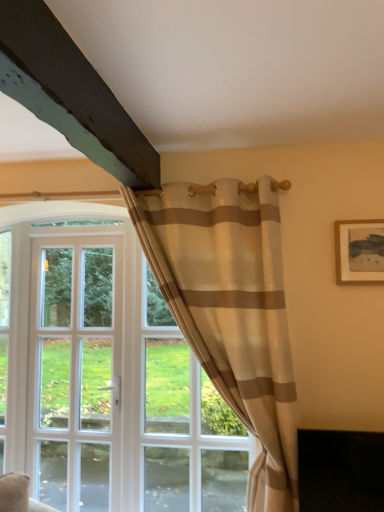
Question: Is wooden framed artwork at upper right outside white glass door at left?

Choices:
 (A) yes
 (B) no

Answer: (A)

Question: Is wooden framed artwork at upper right behind white glass door at left?

Choices:
 (A) no
 (B) yes

Answer: (A)

Question: Does wooden framed artwork at upper right appear on the left side of white glass door at left?

Choices:
 (A) yes
 (B) no

Answer: (B)

Question: Is white glass door at left completely or partially inside wooden framed artwork at upper right?

Choices:
 (A) yes
 (B) no

Answer: (B)

Question: Does wooden framed artwork at upper right have a greater width compared to white glass door at left?

Choices:
 (A) yes
 (B) no

Answer: (B)

Question: Is beige striped fabric at center situated inside wooden framed artwork at upper right or outside?

Choices:
 (A) outside
 (B) inside

Answer: (A)

Question: Considering their positions, is beige striped fabric at center located in front of or behind wooden framed artwork at upper right?

Choices:
 (A) behind
 (B) front

Answer: (B)

Question: Is point (163, 206) positioned closer to the camera than point (377, 267)?

Choices:
 (A) closer
 (B) farther

Answer: (B)

Question: Considering the positions of beige striped fabric at center and wooden framed artwork at upper right in the image, is beige striped fabric at center taller or shorter than wooden framed artwork at upper right?

Choices:
 (A) short
 (B) tall

Answer: (B)

Question: Is white glass door at left inside the boundaries of beige striped fabric at center, or outside?

Choices:
 (A) inside
 (B) outside

Answer: (B)

Question: From a real-world perspective, is white glass door at left physically located above or below beige striped fabric at center?

Choices:
 (A) below
 (B) above

Answer: (A)

Question: From the image's perspective, is white glass door at left above or below beige striped fabric at center?

Choices:
 (A) below
 (B) above

Answer: (A)

Question: Is point (39, 279) closer or farther from the camera than point (210, 258)?

Choices:
 (A) farther
 (B) closer

Answer: (A)

Question: Considering the positions of point (284, 354) and point (107, 412), is point (284, 354) closer or farther from the camera than point (107, 412)?

Choices:
 (A) closer
 (B) farther

Answer: (A)

Question: From the image's perspective, is beige striped fabric at center above or below white glass door at left?

Choices:
 (A) below
 (B) above

Answer: (B)